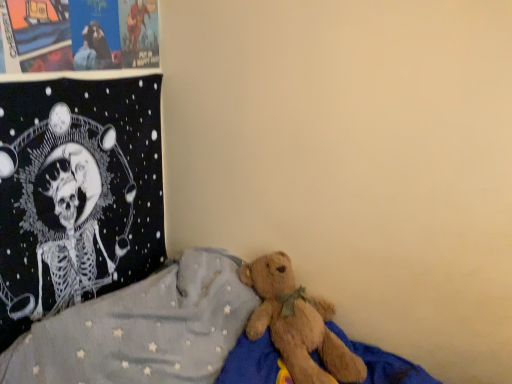
Question: In the image, is black fabric tapestry at upper left positioned in front of or behind brown plush bear at lower right?

Choices:
 (A) behind
 (B) front

Answer: (A)

Question: Looking at the image, does black fabric tapestry at upper left seem bigger or smaller compared to brown plush bear at lower right?

Choices:
 (A) big
 (B) small

Answer: (B)

Question: Estimate the real-world distances between objects in this image. Which object is farther from the black fabric tapestry at upper left?

Choices:
 (A) matte paper posters at upper left
 (B) brown plush bear at lower right

Answer: (B)

Question: Estimate the real-world distances between objects in this image. Which object is closer to the matte paper posters at upper left?

Choices:
 (A) black fabric tapestry at upper left
 (B) brown plush bear at lower right

Answer: (A)